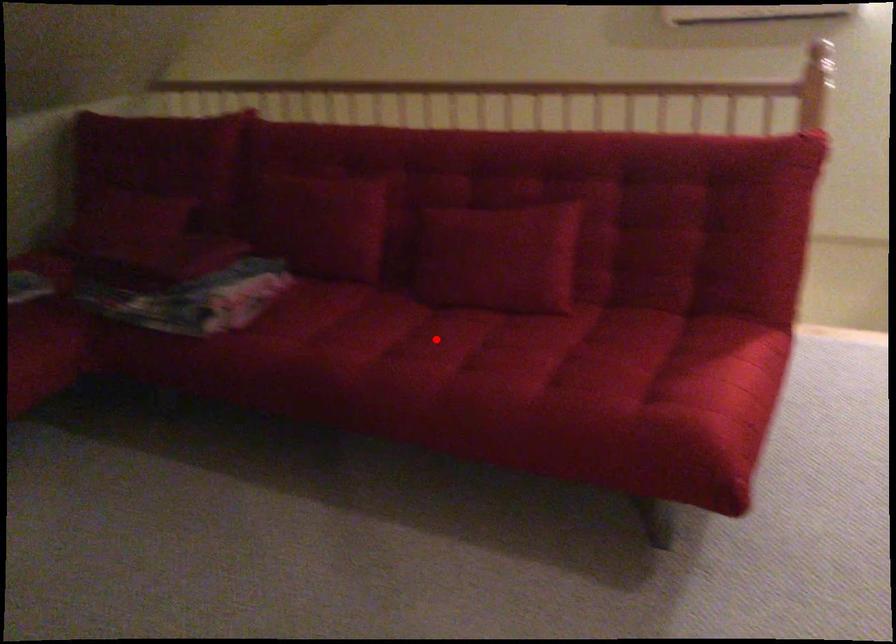
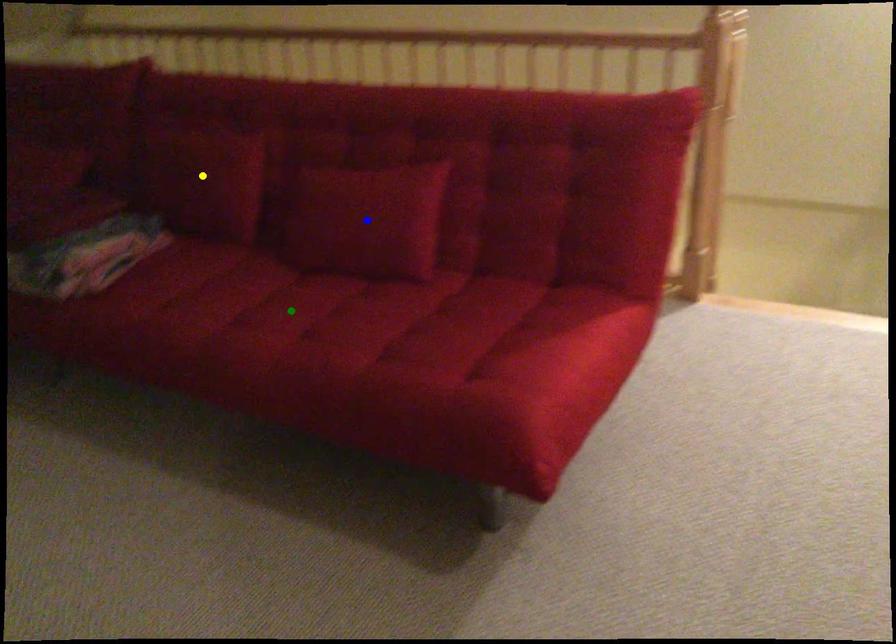
Question: I am providing you with two images of the same scene from different viewpoints. A red point is marked on the first image. You are given multiple points on the second image. Can you choose the point in image 2 that corresponds to the point in image 1?

Choices:
 (A) green point
 (B) yellow point
 (C) blue point

Answer: (A)